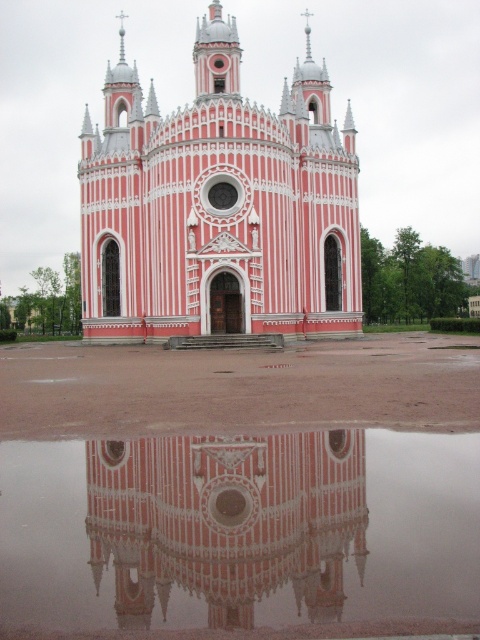
Question: Which object is farther from the camera taking this photo?

Choices:
 (A) pink glossy building at center
 (B) pink polished stone church at center

Answer: (B)

Question: Does pink polished stone church at center have a lesser width compared to pink glossy building at center?

Choices:
 (A) yes
 (B) no

Answer: (B)

Question: Among these points, which one is nearest to the camera?

Choices:
 (A) (335, 276)
 (B) (182, 627)

Answer: (B)

Question: Is the position of pink polished stone church at center less distant than that of pink glossy building at center?

Choices:
 (A) yes
 (B) no

Answer: (B)

Question: Observing the image, what is the correct spatial positioning of pink polished stone church at center in reference to pink glossy building at center?

Choices:
 (A) left
 (B) right

Answer: (A)